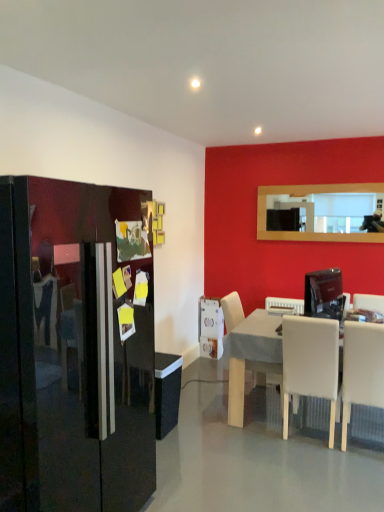
Question: From a real-world perspective, does glossy black refrigerator at left stand above white matte table at center?

Choices:
 (A) yes
 (B) no

Answer: (A)

Question: Considering the relative sizes of glossy black refrigerator at left and white matte table at center in the image provided, is glossy black refrigerator at left wider than white matte table at center?

Choices:
 (A) no
 (B) yes

Answer: (A)

Question: From the image's perspective, does glossy black refrigerator at left appear lower than white matte table at center?

Choices:
 (A) yes
 (B) no

Answer: (B)

Question: Is glossy black refrigerator at left placed right next to white matte table at center?

Choices:
 (A) no
 (B) yes

Answer: (A)

Question: Is the position of glossy black refrigerator at left less distant than that of white matte table at center?

Choices:
 (A) no
 (B) yes

Answer: (B)

Question: Considering the positions of glossy black refrigerator at left and white leather chair at center, which is the 1th chair in left-to-right order, in the image, is glossy black refrigerator at left taller or shorter than white leather chair at center, which is the 1th chair in left-to-right order,?

Choices:
 (A) tall
 (B) short

Answer: (A)

Question: Relative to white leather chair at center, which is counted as the 3th chair, starting from the right, is glossy black refrigerator at left in front or behind?

Choices:
 (A) behind
 (B) front

Answer: (B)

Question: Based on their sizes in the image, would you say glossy black refrigerator at left is bigger or smaller than white leather chair at center, which is counted as the 3th chair, starting from the right?

Choices:
 (A) small
 (B) big

Answer: (B)

Question: From a real-world perspective, is glossy black refrigerator at left positioned above or below white leather chair at center, which is the 1th chair in left-to-right order?

Choices:
 (A) above
 (B) below

Answer: (A)

Question: From a real-world perspective, relative to white glossy toaster at lower center, which ranks as the first appliance in left-to-right order, is white matte chair at lower right, which appears as the second chair when viewed from the right, vertically above or below?

Choices:
 (A) above
 (B) below

Answer: (A)

Question: Do you think white matte chair at lower right, the 2th chair viewed from the left, is within white glossy toaster at lower center, the third appliance when ordered from right to left, or outside of it?

Choices:
 (A) outside
 (B) inside

Answer: (A)

Question: Is point (292, 352) positioned closer to the camera than point (215, 304)?

Choices:
 (A) farther
 (B) closer

Answer: (B)

Question: Relative to white glossy toaster at lower center, which is the first appliance from bottom to top, is white matte chair at lower right, which appears as the second chair when viewed from the right, in front or behind?

Choices:
 (A) front
 (B) behind

Answer: (A)

Question: Is white leather chair at lower right, arranged as the 1th chair when viewed from the right, spatially inside white plastic toaster at center, positioned as the 2th appliance in bottom-to-top order, or outside of it?

Choices:
 (A) outside
 (B) inside

Answer: (A)

Question: Does point (357, 390) appear closer or farther from the camera than point (283, 300)?

Choices:
 (A) farther
 (B) closer

Answer: (B)